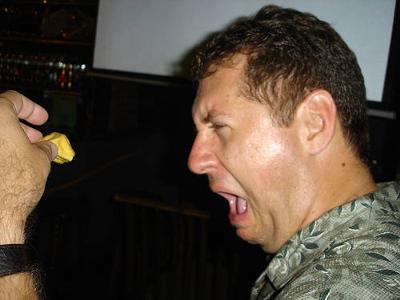
Where is `tv screen`? The image size is (400, 300). tv screen is located at coordinates (134, 37).